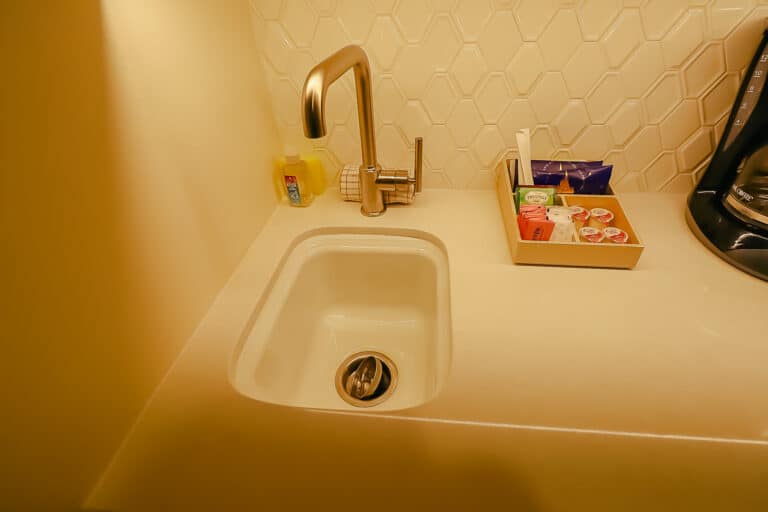
Find the location of a particular element. The image size is (768, 512). hand soap is located at coordinates (300, 188).